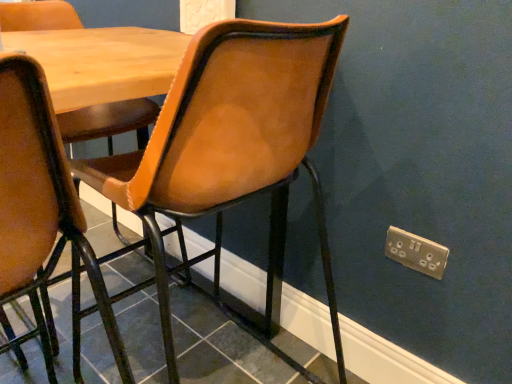
The height and width of the screenshot is (384, 512). I want to click on vacant space situated above matte black tile at lower center (from a real-world perspective), so point(160,329).